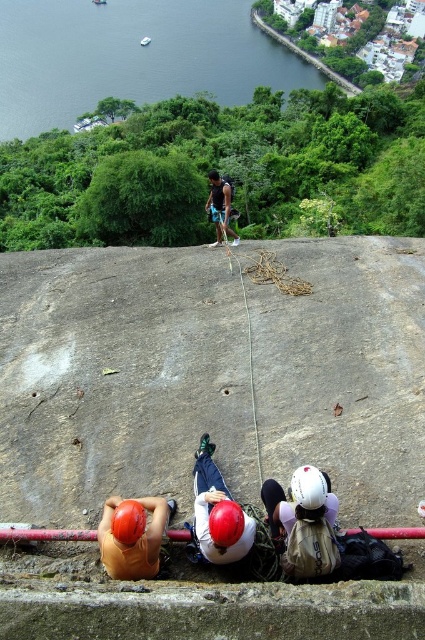
Question: Which point is farther to the camera?

Choices:
 (A) (113, 465)
 (B) (265, 61)

Answer: (B)

Question: Can you confirm if green water at upper left is positioned to the left of orange matte helmet at lower left?

Choices:
 (A) yes
 (B) no

Answer: (A)

Question: Which of the following is the farthest from the observer?

Choices:
 (A) orange matte helmet at lower left
 (B) green water at upper left
 (C) gray rough concrete at center

Answer: (B)

Question: Considering the real-world distances, which object is farthest from the gray rough concrete at center?

Choices:
 (A) orange matte helmet at lower left
 (B) green water at upper left

Answer: (B)

Question: Observing the image, what is the correct spatial positioning of gray rough concrete at center in reference to green water at upper left?

Choices:
 (A) above
 (B) below

Answer: (B)

Question: Where is gray rough concrete at center located in relation to green water at upper left in the image?

Choices:
 (A) below
 (B) above

Answer: (A)